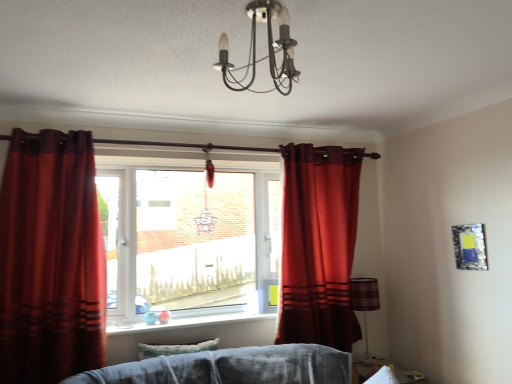
Question: Could you tell me if velvet red curtain at left, arranged as the second curtain when viewed from the right, is facing matte red curtain at center, positioned as the 2th curtain in left-to-right order?

Choices:
 (A) yes
 (B) no

Answer: (B)

Question: Can you confirm if velvet red curtain at left, the 1th curtain when ordered from front to back, is taller than matte red curtain at center, arranged as the 1th curtain when viewed from the right?

Choices:
 (A) no
 (B) yes

Answer: (A)

Question: Can you confirm if velvet red curtain at left, the first curtain viewed from the left, is positioned to the left of matte red curtain at center, placed as the 1th curtain when sorted from back to front?

Choices:
 (A) yes
 (B) no

Answer: (A)

Question: From a real-world perspective, is velvet red curtain at left, the 1th curtain when ordered from front to back, over matte red curtain at center, arranged as the 1th curtain when viewed from the right?

Choices:
 (A) yes
 (B) no

Answer: (A)

Question: Does velvet red curtain at left, the 1th curtain when ordered from front to back, have a lesser width compared to matte red curtain at center, positioned as the 2th curtain in left-to-right order?

Choices:
 (A) no
 (B) yes

Answer: (A)

Question: Does point (456, 235) appear closer or farther from the camera than point (9, 301)?

Choices:
 (A) closer
 (B) farther

Answer: (B)

Question: Is metallic reflective picture frame at upper right bigger or smaller than velvet red curtain at left, the 1th curtain when ordered from front to back?

Choices:
 (A) big
 (B) small

Answer: (B)

Question: Is metallic reflective picture frame at upper right in front of or behind velvet red curtain at left, arranged as the second curtain when viewed from the right, in the image?

Choices:
 (A) front
 (B) behind

Answer: (B)

Question: From the image's perspective, relative to velvet red curtain at left, arranged as the second curtain when viewed from the right, is metallic reflective picture frame at upper right above or below?

Choices:
 (A) above
 (B) below

Answer: (A)

Question: In terms of width, does clear glass window at center look wider or thinner when compared to metallic chandelier at upper center?

Choices:
 (A) wide
 (B) thin

Answer: (B)

Question: Would you say clear glass window at center is to the left or to the right of metallic chandelier at upper center in the picture?

Choices:
 (A) left
 (B) right

Answer: (A)

Question: Would you say clear glass window at center is inside or outside metallic chandelier at upper center?

Choices:
 (A) inside
 (B) outside

Answer: (B)

Question: In the image, is clear glass window at center positioned in front of or behind metallic chandelier at upper center?

Choices:
 (A) behind
 (B) front

Answer: (A)

Question: Is velvet red curtain at left, the 1th curtain when ordered from front to back, to the left or to the right of clear glass window at center in the image?

Choices:
 (A) right
 (B) left

Answer: (B)

Question: Does point (10, 364) appear closer or farther from the camera than point (259, 244)?

Choices:
 (A) closer
 (B) farther

Answer: (A)